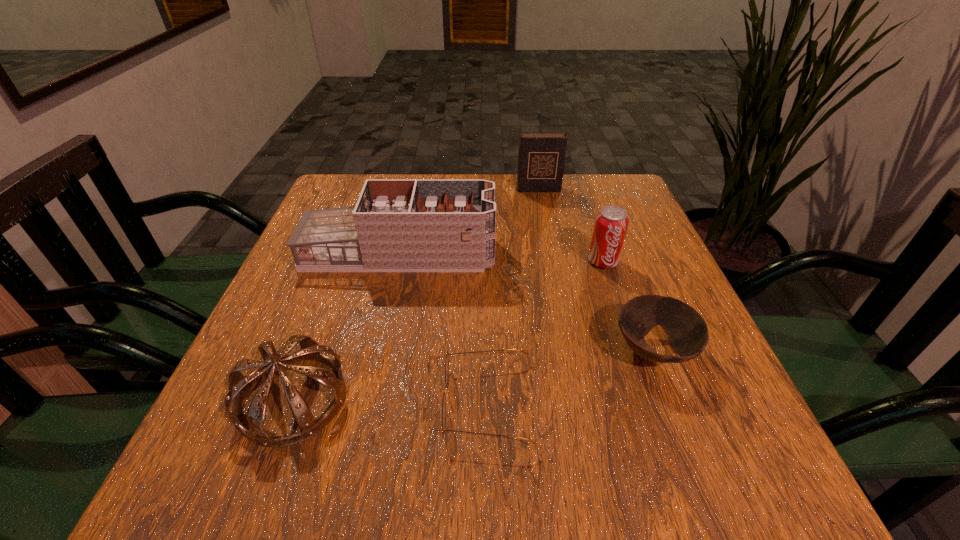
This screenshot has width=960, height=540. In the image, there is a desktop. Find the location of `vacant space at the near right corner`. vacant space at the near right corner is located at coordinates [778, 491].

The width and height of the screenshot is (960, 540). Identify the location of free area in between the dollhouse and the shortest object. (443, 328).

Identify the location of free space between the tiara and the dollhouse. Image resolution: width=960 pixels, height=540 pixels. (346, 327).

This screenshot has width=960, height=540. Find the location of `free space that is in between the tiara and the soda can`. free space that is in between the tiara and the soda can is located at coordinates (447, 330).

Where is `blank region between the tiara and the bowl`? blank region between the tiara and the bowl is located at coordinates (472, 375).

Identify the location of empty space that is in between the diary and the soda can. (570, 225).

I want to click on unoccupied position between the diary and the bowl, so click(x=595, y=271).

Find the location of a particular element. free space between the spectacles and the dollhouse is located at coordinates (443, 328).

The image size is (960, 540). What are the coordinates of `unoccupied position between the spectacles and the bowl` in the screenshot? It's located at (569, 377).

Locate an element on the screen. empty location between the diary and the second shortest object is located at coordinates (595, 271).